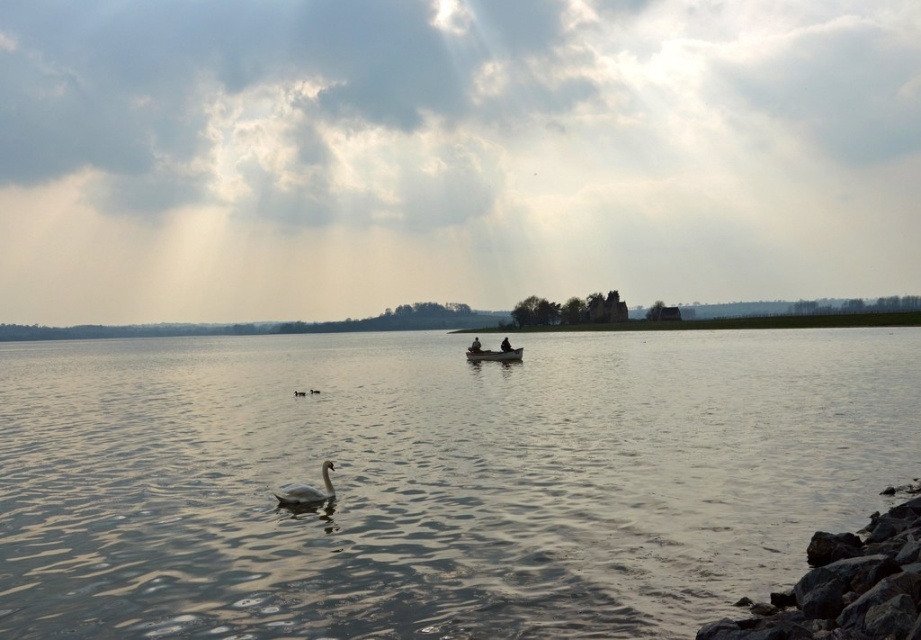
You are a photographer trying to capture the white glossy swan at lower center and the wooden boat at center in the same frame. Based on their positions, which object is closer to the water surface?

The white glossy swan at lower center is located below the wooden boat at center, so it is closer to the water surface.

You are standing on the lakeside dock and want to take a photo of the white glossy swan at lower center and the wooden boat at center. Which object should you focus on first if you want to capture both in a single shot without moving the camera?

You should focus on the white glossy swan at lower center first because it is closer to the viewer than the wooden boat at center, allowing you to adjust the depth of field to include both in the frame.